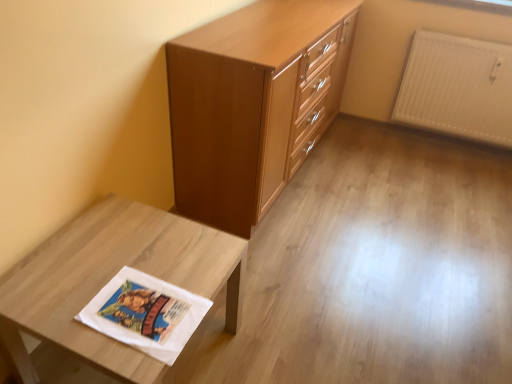
The image size is (512, 384). In order to click on matte wood chest of drawers at center in this screenshot , I will do `click(253, 103)`.

Measure the distance between white textured radiator at upper right and camera.

They are 7.91 feet apart.

In order to face white matte fabric at lower left, should I rotate leftwards or rightwards?

A 16.011 degree turn to the left will do.

The image size is (512, 384). In order to click on matte wood chest of drawers at center in this screenshot , I will do `click(253, 103)`.

Is white matte fabric at lower left inside or outside of matte wood chest of drawers at center?

white matte fabric at lower left lies outside matte wood chest of drawers at center.

Is white matte fabric at lower left oriented away from matte wood chest of drawers at center?

No, matte wood chest of drawers at center is not at the back of white matte fabric at lower left.

Between point (88, 341) and point (333, 39), which one is positioned behind?

Point (333, 39)

In the image, is white textured radiator at upper right positioned in front of or behind white matte fabric at lower left?

white textured radiator at upper right is behind white matte fabric at lower left.

From a real-world perspective, between white textured radiator at upper right and white matte fabric at lower left, who is vertically higher?

white textured radiator at upper right is physically above.

Which of these two, white textured radiator at upper right or white matte fabric at lower left, is smaller?

Smaller between the two is white textured radiator at upper right.

Between white textured radiator at upper right and matte wood chest of drawers at center, which one has smaller width?

With smaller width is white textured radiator at upper right.

Who is taller, white textured radiator at upper right or matte wood chest of drawers at center?

With more height is matte wood chest of drawers at center.

From a real-world perspective, which object stands above the other?

From a 3D spatial view, matte wood chest of drawers at center is above.

From a real-world perspective, is matte wood chest of drawers at center above or below white textured radiator at upper right?

Clearly, from a real-world perspective, matte wood chest of drawers at center is above white textured radiator at upper right.

Looking at this image, do you think matte wood chest of drawers at center is within white textured radiator at upper right, or outside of it?

matte wood chest of drawers at center lies outside white textured radiator at upper right.

From the image's perspective, relative to white textured radiator at upper right, is matte wood chest of drawers at center above or below?

matte wood chest of drawers at center is situated lower than white textured radiator at upper right in the image.

Is matte wood chest of drawers at center positioned behind white textured radiator at upper right?

No.

Which of these two, white matte fabric at lower left or white textured radiator at upper right, is smaller?

white textured radiator at upper right is smaller.

From a real-world perspective, is white matte fabric at lower left physically located above or below white textured radiator at upper right?

Clearly, from a real-world perspective, white matte fabric at lower left is below white textured radiator at upper right.

Can you confirm if white matte fabric at lower left is thinner than white textured radiator at upper right?

Incorrect, the width of white matte fabric at lower left is not less than that of white textured radiator at upper right.

Considering the relative positions of white matte fabric at lower left and white textured radiator at upper right in the image provided, is white matte fabric at lower left to the right of white textured radiator at upper right from the viewer's perspective?

No.

What's the angular difference between matte wood chest of drawers at center and white matte fabric at lower left's facing directions?

They differ by 0.24 degrees in their facing directions.

Locate an element on the screen. This screenshot has width=512, height=384. table located on the left of matte wood chest of drawers at center is located at coordinates (109, 279).

Considering the relative sizes of matte wood chest of drawers at center and white matte fabric at lower left in the image provided, is matte wood chest of drawers at center bigger than white matte fabric at lower left?

Correct, matte wood chest of drawers at center is larger in size than white matte fabric at lower left.

From a real-world perspective, relative to white matte fabric at lower left, is matte wood chest of drawers at center vertically above or below?

matte wood chest of drawers at center is situated higher than white matte fabric at lower left in the real world.

The width and height of the screenshot is (512, 384). Identify the location of the chest of drawers above the white matte fabric at lower left (from the image's perspective). (253, 103).

Identify the location of table in front of the white textured radiator at upper right. (109, 279).

Estimate the real-world distances between objects in this image. Which object is closer to matte wood chest of drawers at center, white matte fabric at lower left or white textured radiator at upper right?

Among the two, white matte fabric at lower left is located nearer to matte wood chest of drawers at center.

When comparing their distances from white matte fabric at lower left, does white textured radiator at upper right or matte wood chest of drawers at center seem further?

white textured radiator at upper right.

Estimate the real-world distances between objects in this image. Which object is further from white textured radiator at upper right, matte wood chest of drawers at center or white matte fabric at lower left?

Based on the image, white matte fabric at lower left appears to be further to white textured radiator at upper right.

Estimate the real-world distances between objects in this image. Which object is further from white textured radiator at upper right, white matte fabric at lower left or matte wood chest of drawers at center?

Among the two, white matte fabric at lower left is located further to white textured radiator at upper right.

Looking at this image, based on their spatial positions, is white textured radiator at upper right or white matte fabric at lower left closer to matte wood chest of drawers at center?

white matte fabric at lower left is positioned closer to the anchor matte wood chest of drawers at center.

Considering their positions, is matte wood chest of drawers at center positioned closer to white matte fabric at lower left than white textured radiator at upper right?

matte wood chest of drawers at center is positioned closer to the anchor white matte fabric at lower left.

Find the location of `chest of drawers between white matte fabric at lower left and white textured radiator at upper right`. chest of drawers between white matte fabric at lower left and white textured radiator at upper right is located at coordinates (253, 103).